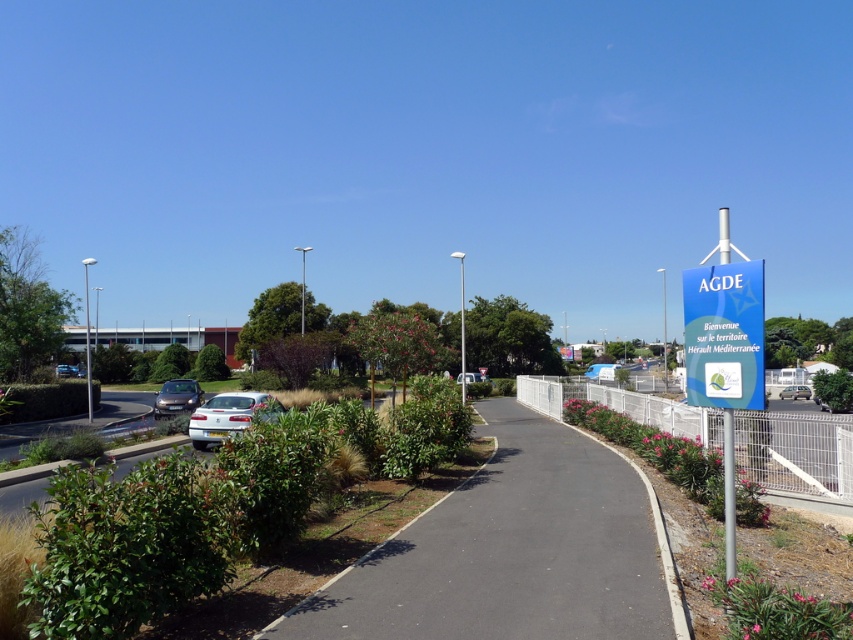
Does black asphalt path at center have a greater height compared to silver metallic sedan at center?

No, black asphalt path at center is not taller than silver metallic sedan at center.

Who is taller, black asphalt path at center or silver metallic sedan at center?

With more height is silver metallic sedan at center.

Find the location of a particular element. This screenshot has width=853, height=640. black asphalt path at center is located at coordinates (512, 552).

Does black asphalt path at center appear over blue plastic sign at right?

Actually, black asphalt path at center is below blue plastic sign at right.

Which is more to the right, black asphalt path at center or blue plastic sign at right?

Positioned to the right is blue plastic sign at right.

Is point (610, 563) positioned in front of point (688, 364)?

No.

Locate an element on the screen. black asphalt path at center is located at coordinates tap(512, 552).

This screenshot has width=853, height=640. I want to click on black asphalt path at center, so click(512, 552).

Is black asphalt path at center further to camera compared to silver metallic van at right?

No.

Identify the location of black asphalt path at center. (512, 552).